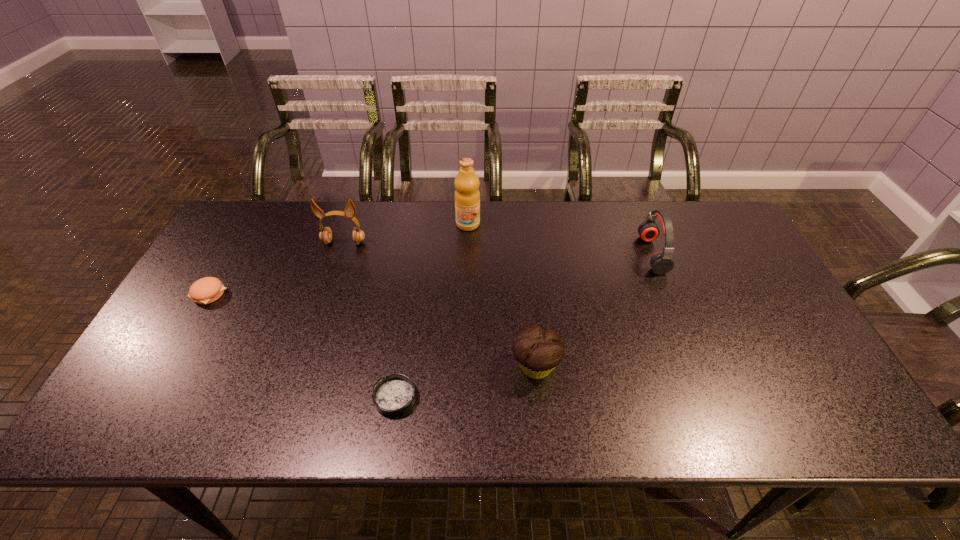
The image size is (960, 540). I want to click on object at the near edge, so click(x=394, y=395).

Locate an element on the screen. The image size is (960, 540). object at the left edge is located at coordinates (206, 290).

Locate an element on the screen. The image size is (960, 540). blank space at the far edge is located at coordinates (335, 216).

The image size is (960, 540). What are the coordinates of `vacant space at the left edge` in the screenshot? It's located at (245, 278).

The width and height of the screenshot is (960, 540). I want to click on vacant space at the right edge of the desktop, so click(x=766, y=380).

In the image, there is a desktop. Where is `vacant space at the far left corner`? vacant space at the far left corner is located at coordinates (244, 234).

At what (x,y) coordinates should I click in order to perform the action: click on vacant space at the near left corner of the desktop. Please return your answer as a coordinate pair (x, y). This screenshot has width=960, height=540. Looking at the image, I should click on (148, 419).

Identify the location of vacant space at the near right corner. This screenshot has height=540, width=960. 854,427.

At what (x,y) coordinates should I click in order to perform the action: click on empty space between the fruit juice and the leftmost object. Please return your answer as a coordinate pair (x, y). Looking at the image, I should click on (339, 259).

Identify the location of free space that is in between the left earphone and the leftmost object. The width and height of the screenshot is (960, 540). (276, 268).